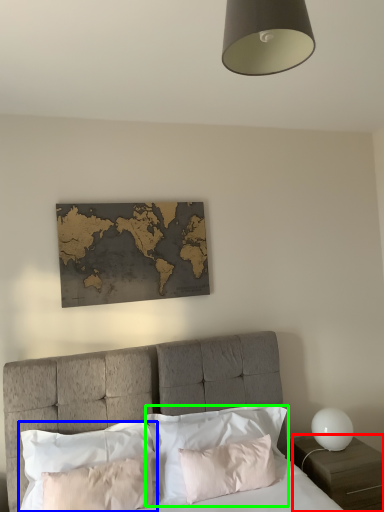
Question: Which object is positioned farthest from nightstand (highlighted by a red box)? Select from pillow (highlighted by a blue box) and pillow (highlighted by a green box).

Choices:
 (A) pillow
 (B) pillow

Answer: (A)